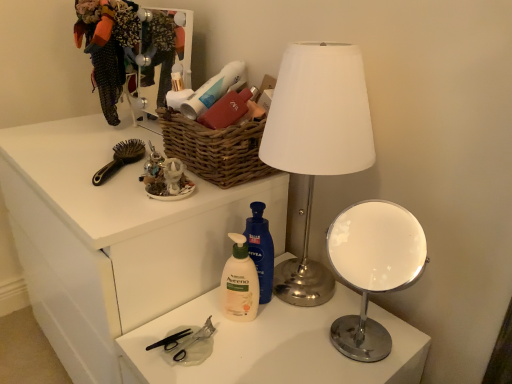
Where is `vacant area to the left of black plastic brush at upper left`? vacant area to the left of black plastic brush at upper left is located at coordinates (60, 163).